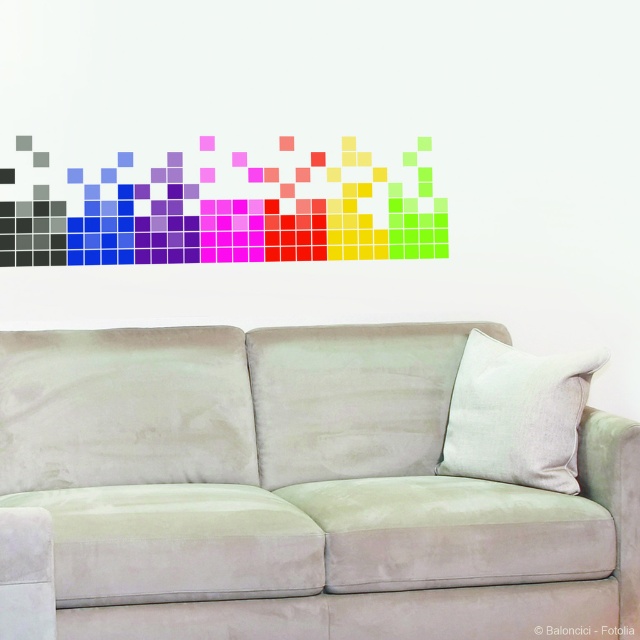
Question: Which of these objects is positioned closest to the suede couch at center?

Choices:
 (A) white linen pillow at center
 (B) matte black pixel art at upper left

Answer: (A)

Question: Which of the following is the closest to the observer?

Choices:
 (A) matte black pixel art at upper left
 (B) suede couch at center

Answer: (B)

Question: Is suede couch at center below matte black pixel art at upper left?

Choices:
 (A) no
 (B) yes

Answer: (B)

Question: Which of the following is the farthest from the observer?

Choices:
 (A) matte black pixel art at upper left
 (B) white linen pillow at center

Answer: (A)

Question: Can you confirm if matte black pixel art at upper left is positioned below white linen pillow at center?

Choices:
 (A) yes
 (B) no

Answer: (B)

Question: Can you confirm if suede couch at center is thinner than matte black pixel art at upper left?

Choices:
 (A) no
 (B) yes

Answer: (A)